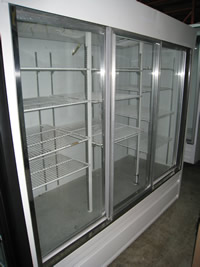
Locate an element on the screen. This screenshot has height=267, width=200. slits in back wall of fridge for shelf height is located at coordinates (39, 122), (52, 112), (92, 62).